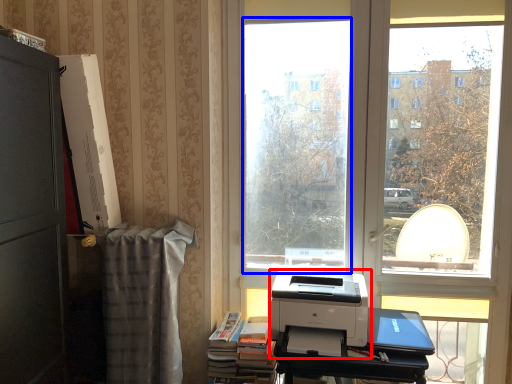
Question: Which point is closer to the camera, printer (highlighted by a red box) or window screen (highlighted by a blue box)?

Choices:
 (A) printer
 (B) window screen

Answer: (A)